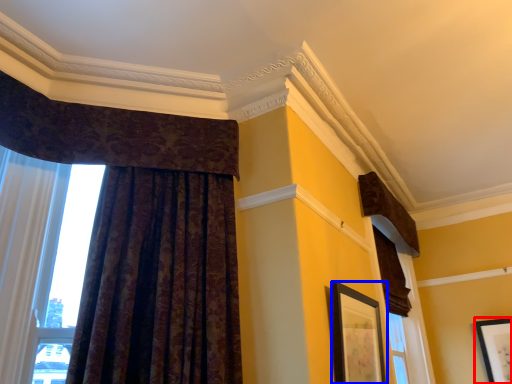
Question: Which object appears farthest to the camera in this image, picture frame (highlighted by a red box) or picture frame (highlighted by a blue box)?

Choices:
 (A) picture frame
 (B) picture frame

Answer: (A)